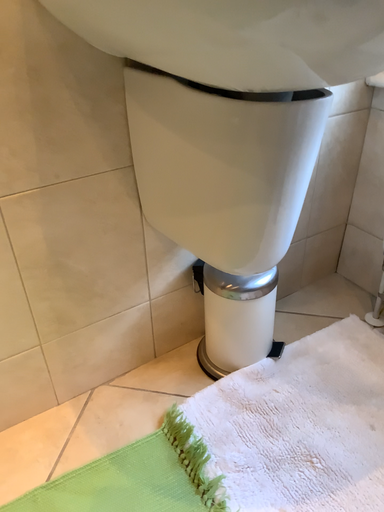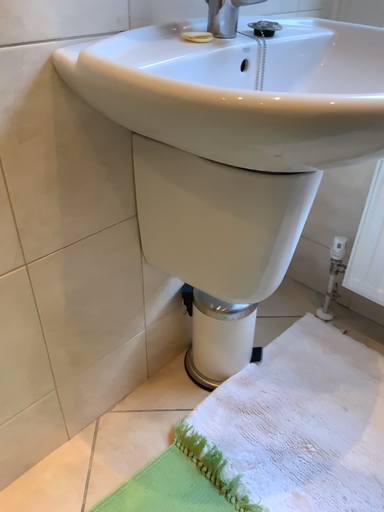
Question: How did the camera likely rotate when shooting the video?

Choices:
 (A) rotated left
 (B) rotated right

Answer: (B)